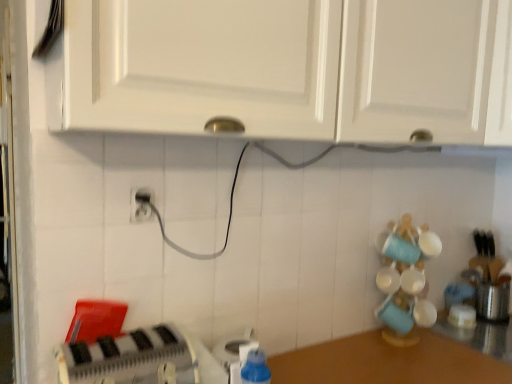
Question: Does blue plastic soap dispenser at lower center, the 2th appliance in the front-to-back sequence, come in front of brown wooden counter at lower right?

Choices:
 (A) yes
 (B) no

Answer: (B)

Question: Are blue plastic soap dispenser at lower center, marked as the 2th appliance in a right-to-left arrangement, and brown wooden counter at lower right located far from each other?

Choices:
 (A) no
 (B) yes

Answer: (A)

Question: Can you confirm if blue plastic soap dispenser at lower center, the 2th appliance in the front-to-back sequence, is positioned to the left of brown wooden counter at lower right?

Choices:
 (A) no
 (B) yes

Answer: (B)

Question: Is blue plastic soap dispenser at lower center, the 2th appliance from the left, outside brown wooden counter at lower right?

Choices:
 (A) no
 (B) yes

Answer: (B)

Question: From a real-world perspective, is blue plastic soap dispenser at lower center, acting as the 2th appliance starting from the back, beneath brown wooden counter at lower right?

Choices:
 (A) yes
 (B) no

Answer: (B)

Question: Can you confirm if blue plastic soap dispenser at lower center, acting as the 2th appliance starting from the back, is wider than brown wooden counter at lower right?

Choices:
 (A) no
 (B) yes

Answer: (A)

Question: Does white matte cabinet at upper center, arranged as the 1th cabinetry when viewed from the right, have a greater height compared to white matte cabinet at upper center, placed as the 1th cabinetry when sorted from left to right?

Choices:
 (A) yes
 (B) no

Answer: (A)

Question: Can you confirm if white matte cabinet at upper center, arranged as the 2th cabinetry when viewed from the left, is bigger than white matte cabinet at upper center, placed as the 1th cabinetry when sorted from left to right?

Choices:
 (A) yes
 (B) no

Answer: (B)

Question: Does white matte cabinet at upper center, arranged as the 2th cabinetry when viewed from the left, have a lesser width compared to white matte cabinet at upper center, placed as the 1th cabinetry when sorted from left to right?

Choices:
 (A) no
 (B) yes

Answer: (A)

Question: Considering the relative sizes of white matte cabinet at upper center, arranged as the 1th cabinetry when viewed from the right, and white matte cabinet at upper center, placed as the 1th cabinetry when sorted from left to right, in the image provided, is white matte cabinet at upper center, arranged as the 1th cabinetry when viewed from the right, smaller than white matte cabinet at upper center, placed as the 1th cabinetry when sorted from left to right,?

Choices:
 (A) yes
 (B) no

Answer: (A)

Question: Could you tell me if white matte cabinet at upper center, arranged as the 1th cabinetry when viewed from the right, is facing white matte cabinet at upper center, placed as the 2th cabinetry when sorted from right to left?

Choices:
 (A) no
 (B) yes

Answer: (A)

Question: Would you say white matte cabinet at upper center, arranged as the 2th cabinetry when viewed from the left, is outside white matte cabinet at upper center, placed as the 1th cabinetry when sorted from left to right?

Choices:
 (A) no
 (B) yes

Answer: (B)

Question: Is brown wooden counter at lower right at the left side of white matte cabinet at upper center, arranged as the 1th cabinetry when viewed from the right?

Choices:
 (A) no
 (B) yes

Answer: (B)